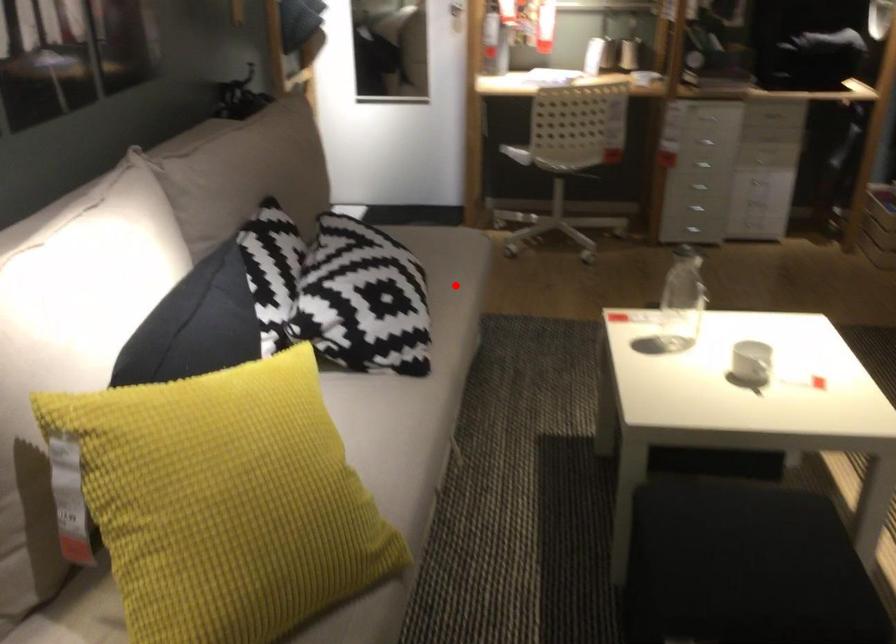
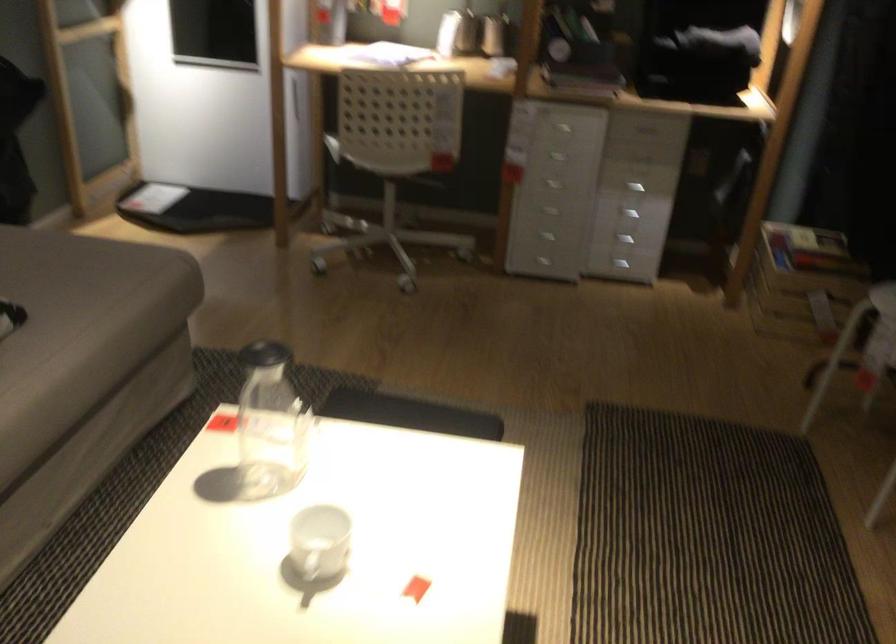
Question: I am providing you with two images of the same scene from different viewpoints. Image1 has a red point marked. In image2, the corresponding 3D location appears at what relative position? Reply with the corresponding letter.

Choices:
 (A) Closer
 (B) Farther

Answer: (A)